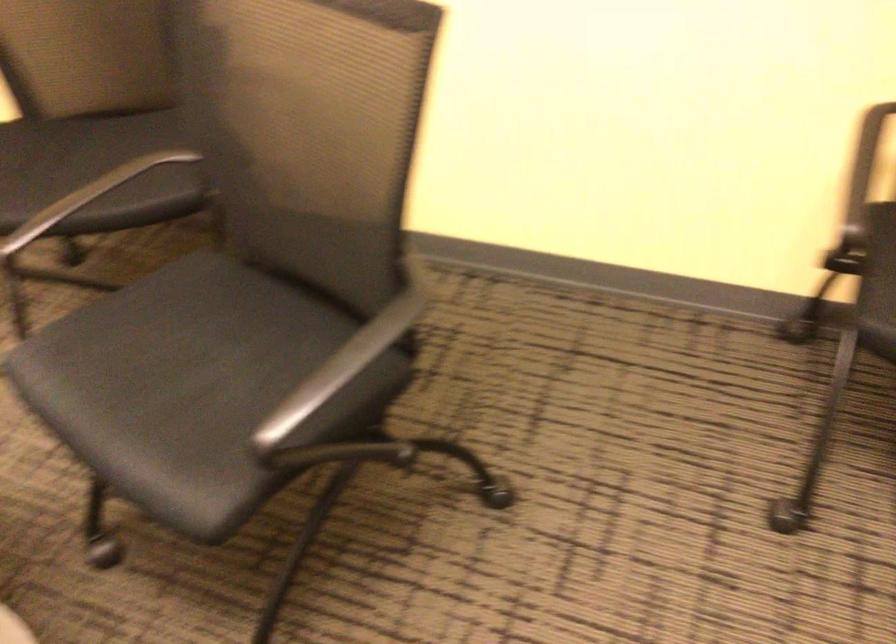
Question: How did the camera likely rotate?

Choices:
 (A) Left
 (B) Right
 (C) Up
 (D) Down

Answer: (A)